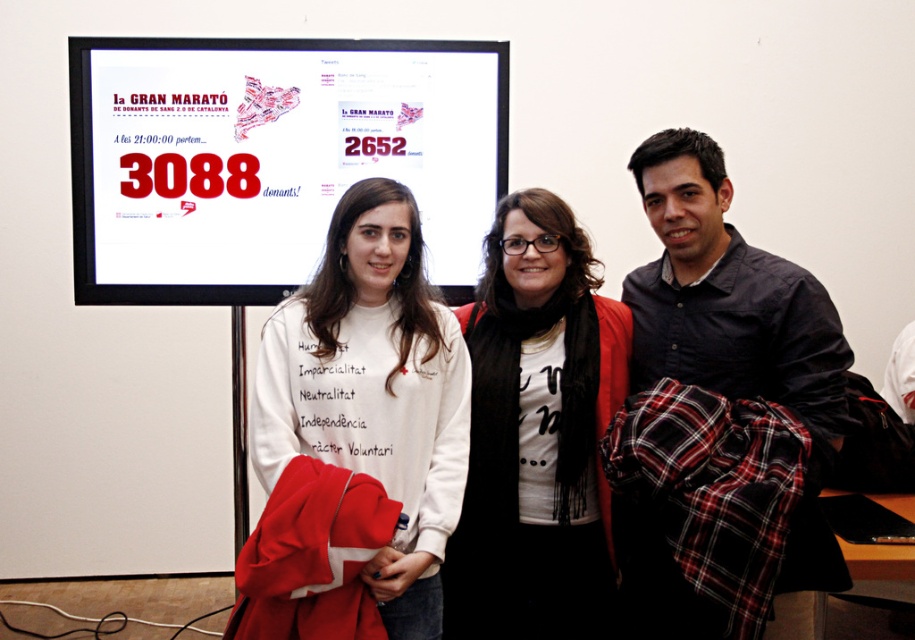
What is located at the point marked by coordinates [272,157] in the image?

The point marked by coordinates [272,157] corresponds to the location of the matte white poster at upper center.